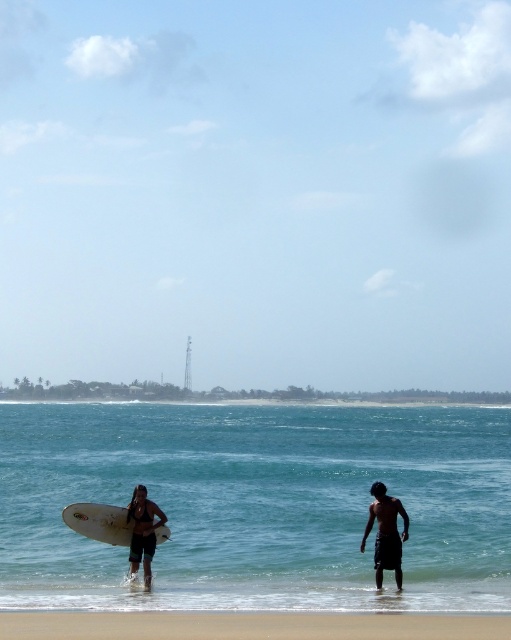
Is dark brown skin at lower right closer to camera compared to matte black surfboard at center?

Yes, it is in front of matte black surfboard at center.

Locate an element on the screen. This screenshot has width=511, height=640. dark brown skin at lower right is located at coordinates tap(385, 532).

Where is `dark brown skin at lower right`? dark brown skin at lower right is located at coordinates (385, 532).

Can you confirm if sandy beach at lower center is shorter than white matte surfboard at lower left?

Yes, sandy beach at lower center is shorter than white matte surfboard at lower left.

Between point (290, 616) and point (111, 516), which one is positioned in front?

Point (290, 616)

Where is `sandy beach at lower center`? Image resolution: width=511 pixels, height=640 pixels. sandy beach at lower center is located at coordinates (251, 625).

Is clear blue water at center thinner than sandy beach at lower center?

Incorrect, clear blue water at center's width is not less than sandy beach at lower center's.

The image size is (511, 640). In order to click on clear blue water at center in this screenshot , I will do `click(257, 502)`.